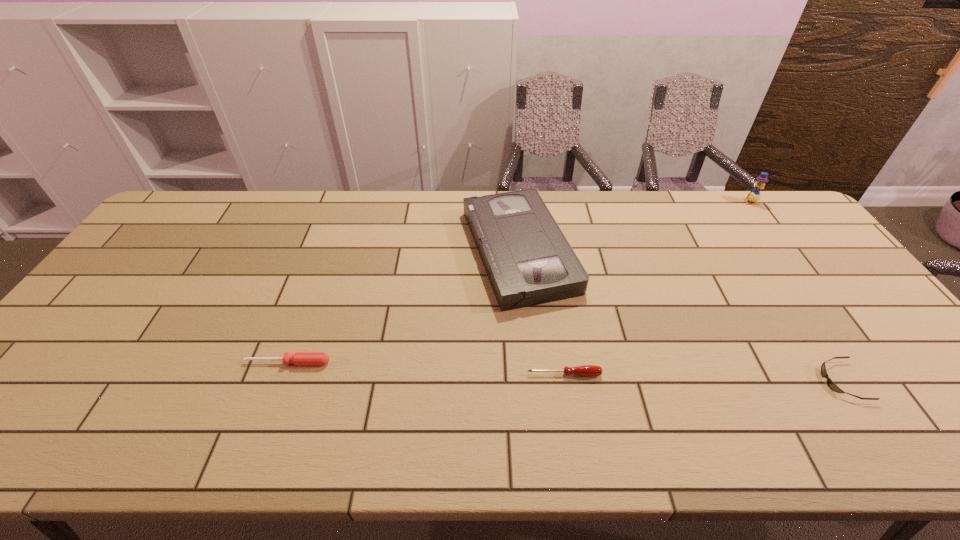
At what (x,y) coordinates should I click in order to perform the action: click on vacant space located on the left of the left screwdriver. Please return your answer as a coordinate pair (x, y). The image size is (960, 540). Looking at the image, I should click on (x=226, y=362).

This screenshot has width=960, height=540. Find the location of `vacant area situated 0.080m on the back of the right screwdriver`. vacant area situated 0.080m on the back of the right screwdriver is located at coordinates (559, 342).

This screenshot has height=540, width=960. What are the coordinates of `free location located on the front-facing side of the sunglasses` in the screenshot? It's located at (684, 381).

The image size is (960, 540). Identify the location of free spot located on the front-facing side of the sunglasses. (697, 381).

I want to click on vacant region located 0.110m on the front-facing side of the sunglasses, so click(778, 381).

Where is `duckling at the far edge`? The height and width of the screenshot is (540, 960). duckling at the far edge is located at coordinates (754, 195).

What are the coordinates of `videotape present at the far edge` in the screenshot? It's located at (528, 260).

Locate an element on the screen. duckling that is at the right edge is located at coordinates (754, 195).

Locate an element on the screen. The height and width of the screenshot is (540, 960). sunglasses situated at the right edge is located at coordinates (830, 383).

Locate an element on the screen. This screenshot has height=540, width=960. object present at the far right corner is located at coordinates (754, 195).